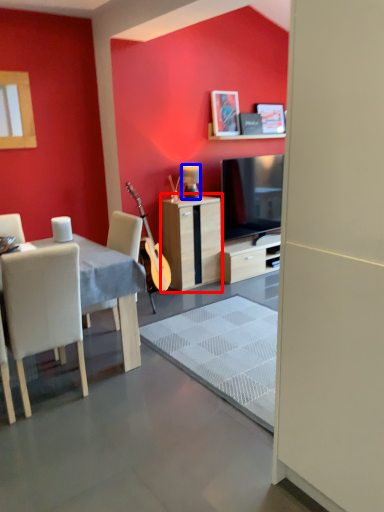
Question: Which object appears closest to the camera in this image, cabinetry (highlighted by a red box) or lamp (highlighted by a blue box)?

Choices:
 (A) cabinetry
 (B) lamp

Answer: (A)